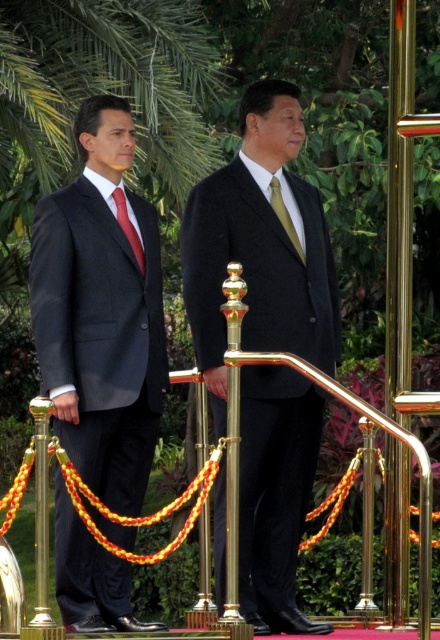
You are a photographer at a diplomatic event and need to adjust your camera focus. You see the black matte suit at center and the red satin tie at left. Which object should you focus on first if you want to capture the one closer to the camera?

The red satin tie at left is closer to the camera than the black matte suit at center, so you should focus on the red satin tie at left first.

From the picture: You are organizing a photo shoot and need to arrange two models wearing the black matte suit at center and the matte black suit at left. Since you want the smaller suit to be more noticeable, where should you place it?

The black matte suit at center is bigger than the matte black suit at left. To make the smaller suit more noticeable, place the matte black suit at left in a prominent position, such as the front or center of the frame, where its smaller size won t be overshadowed by the larger suit.

You are a photographer at an event and need to capture a closeup of the red satin tie at left and the gold silk tie at center. Which tie will appear larger in the photo if you focus on the one that is closer to the camera?

The red satin tie at left is positioned under gold silk tie at center, so focusing on the gold silk tie at center would make it appear larger in the photo since it is closer to the camera.